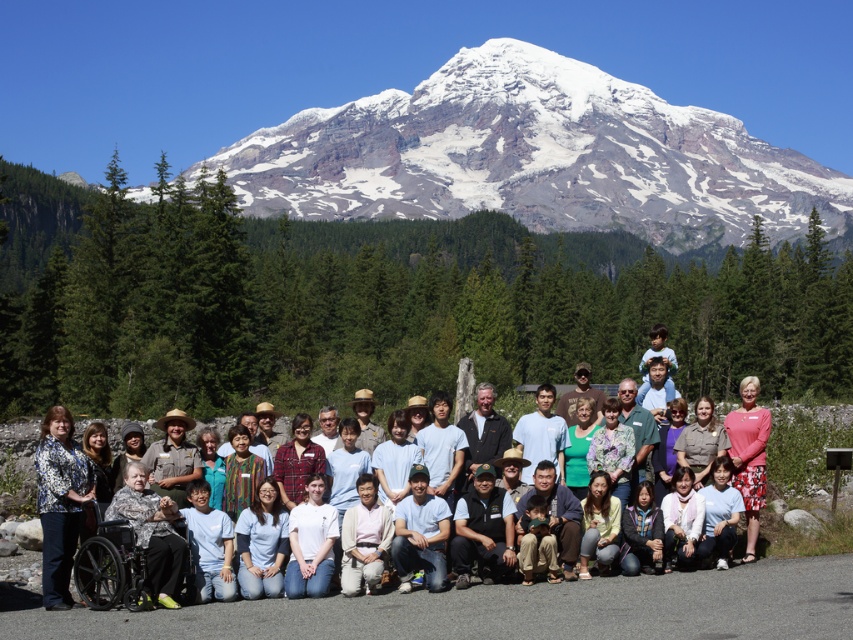
Is light blue shirt at center taller than pink fabric dress at lower right?

Yes, light blue shirt at center is taller than pink fabric dress at lower right.

Measure the distance from light blue shirt at center to pink fabric dress at lower right.

light blue shirt at center is 70.77 meters away from pink fabric dress at lower right.

Is point (143, 346) in front of point (751, 534)?

No, (143, 346) is further to viewer.

You are a GUI agent. You are given a task and a screenshot of the screen. Output one action in this format:
    pyautogui.click(x=<x>, y=<y>)
    Task: Click on the light blue shirt at center
    
    Given the screenshot: What is the action you would take?
    pyautogui.click(x=718, y=365)

What do you see at coordinates (749, 456) in the screenshot?
I see `pink fabric dress at lower right` at bounding box center [749, 456].

Which is above, pink fabric dress at lower right or white cotton shirt at center?

pink fabric dress at lower right is above.

The height and width of the screenshot is (640, 853). Find the location of `pink fabric dress at lower right`. pink fabric dress at lower right is located at coordinates (749, 456).

Where is `pink fabric dress at lower right`? This screenshot has height=640, width=853. pink fabric dress at lower right is located at coordinates (749, 456).

Between light blue shirt at center and floral-patterned blouse at lower left, which one appears on the right side from the viewer's perspective?

light blue shirt at center is more to the right.

Does point (437, 337) come closer to viewer compared to point (44, 490)?

No, (437, 337) is behind (44, 490).

Who is more distant from viewer, (704, 388) or (51, 461)?

The point (704, 388) is more distant.

This screenshot has width=853, height=640. In order to click on light blue shirt at center in this screenshot , I will do `click(718, 365)`.